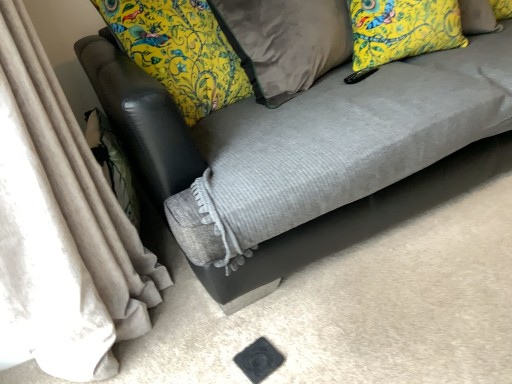
Question: Are velvet brown pillow at center, marked as the 1th pillow in a left-to-right arrangement, and textured gray couch at center far apart?

Choices:
 (A) yes
 (B) no

Answer: (B)

Question: Is velvet brown pillow at center, marked as the 1th pillow in a left-to-right arrangement, at the left side of textured gray couch at center?

Choices:
 (A) yes
 (B) no

Answer: (A)

Question: Could you tell me if velvet brown pillow at center, the 2th pillow in the right-to-left sequence, is facing textured gray couch at center?

Choices:
 (A) yes
 (B) no

Answer: (A)

Question: Can you confirm if velvet brown pillow at center, the 2th pillow in the right-to-left sequence, is thinner than textured gray couch at center?

Choices:
 (A) no
 (B) yes

Answer: (B)

Question: Can you confirm if velvet brown pillow at center, the 2th pillow in the right-to-left sequence, is smaller than textured gray couch at center?

Choices:
 (A) no
 (B) yes

Answer: (B)

Question: Considering the positions of yellow floral fabric pillow at upper right, the 2th pillow positioned from the left, and textured gray couch at center in the image, is yellow floral fabric pillow at upper right, the 2th pillow positioned from the left, wider or thinner than textured gray couch at center?

Choices:
 (A) thin
 (B) wide

Answer: (A)

Question: From a real-world perspective, is yellow floral fabric pillow at upper right, the 1th pillow viewed from the right, positioned above or below textured gray couch at center?

Choices:
 (A) below
 (B) above

Answer: (B)

Question: Does point tap(357, 36) appear closer or farther from the camera than point tap(445, 76)?

Choices:
 (A) farther
 (B) closer

Answer: (A)

Question: Would you say yellow floral fabric pillow at upper right, the 2th pillow positioned from the left, is inside or outside textured gray couch at center?

Choices:
 (A) inside
 (B) outside

Answer: (A)

Question: From a real-world perspective, is velvet brown pillow at center, marked as the 1th pillow in a left-to-right arrangement, physically located above or below yellow floral fabric pillow at upper right, the 1th pillow viewed from the right?

Choices:
 (A) below
 (B) above

Answer: (A)

Question: Do you think velvet brown pillow at center, marked as the 1th pillow in a left-to-right arrangement, is within yellow floral fabric pillow at upper right, the 2th pillow positioned from the left, or outside of it?

Choices:
 (A) outside
 (B) inside

Answer: (A)

Question: Considering their positions, is velvet brown pillow at center, the 2th pillow in the right-to-left sequence, located in front of or behind yellow floral fabric pillow at upper right, the 2th pillow positioned from the left?

Choices:
 (A) front
 (B) behind

Answer: (A)

Question: From the image's perspective, is velvet brown pillow at center, marked as the 1th pillow in a left-to-right arrangement, located above or below yellow floral fabric pillow at upper right, the 2th pillow positioned from the left?

Choices:
 (A) above
 (B) below

Answer: (B)

Question: In terms of height, does textured gray couch at center look taller or shorter compared to velvet brown pillow at center, the 2th pillow in the right-to-left sequence?

Choices:
 (A) tall
 (B) short

Answer: (A)

Question: In terms of size, does textured gray couch at center appear bigger or smaller than velvet brown pillow at center, the 2th pillow in the right-to-left sequence?

Choices:
 (A) small
 (B) big

Answer: (B)